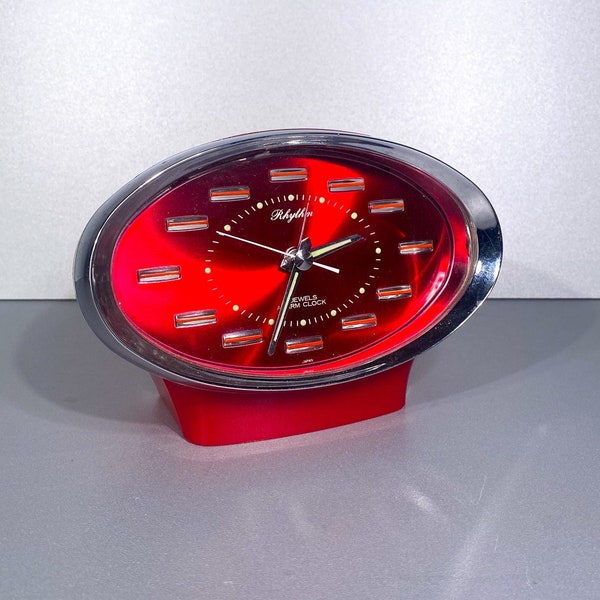
Where is `white wall`? This screenshot has height=600, width=600. white wall is located at coordinates point(418,77).